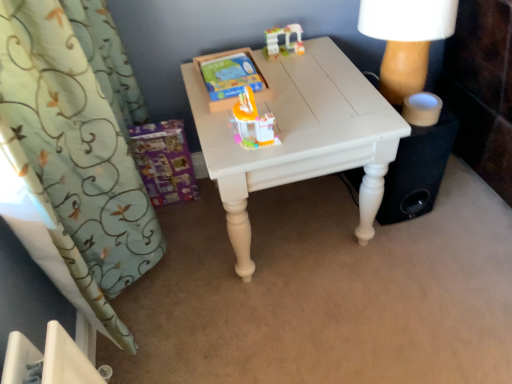
What do you see at coordinates (284, 41) in the screenshot?
I see `translucent plastic building at upper center, placed as the first toy when sorted from back to front` at bounding box center [284, 41].

What do you see at coordinates (300, 136) in the screenshot?
I see `white painted wood table at center` at bounding box center [300, 136].

The height and width of the screenshot is (384, 512). What do you see at coordinates (252, 123) in the screenshot?
I see `translucent plastic toy at center, acting as the second toy starting from the top` at bounding box center [252, 123].

The image size is (512, 384). I want to click on translucent plastic building at upper center, marked as the 2th toy in a front-to-back arrangement, so click(284, 41).

Is translucent plastic toy at center, the second toy when ordered from back to front, next to green floral fabric curtain at left?

translucent plastic toy at center, the second toy when ordered from back to front, and green floral fabric curtain at left are clearly separated.

From a real-world perspective, is translucent plastic toy at center, the second toy when ordered from back to front, physically located above or below green floral fabric curtain at left?

translucent plastic toy at center, the second toy when ordered from back to front, is above green floral fabric curtain at left.

Can you confirm if translucent plastic toy at center, arranged as the first toy when viewed from the front, is wider than green floral fabric curtain at left?

No.

You are a GUI agent. You are given a task and a screenshot of the screen. Output one action in this format:
    pyautogui.click(x=<x>, y=<y>)
    Task: Click on the curtain that is under the translucent plastic toy at center, arranged as the first toy when viewed from the front (from a real-world perspective)
    The height and width of the screenshot is (384, 512).
    Given the screenshot: What is the action you would take?
    pyautogui.click(x=81, y=141)

Is white painted wood table at center wider than translucent plastic toy at center, acting as the second toy starting from the top?

Yes, white painted wood table at center is wider than translucent plastic toy at center, acting as the second toy starting from the top.

Is white painted wood table at center inside or outside of translucent plastic toy at center, the second toy when ordered from back to front?

white painted wood table at center is not inside translucent plastic toy at center, the second toy when ordered from back to front, it's outside.

Considering the sizes of objects white painted wood table at center and translucent plastic toy at center, acting as the second toy starting from the top, in the image provided, who is taller, white painted wood table at center or translucent plastic toy at center, acting as the second toy starting from the top,?

white painted wood table at center is taller.

Does white painted wood table at center appear on the left side of green floral fabric curtain at left?

No.

In terms of size, does white painted wood table at center appear bigger or smaller than green floral fabric curtain at left?

white painted wood table at center is smaller than green floral fabric curtain at left.

From the image's perspective, is white painted wood table at center positioned above or below green floral fabric curtain at left?

Clearly, from the image's perspective, white painted wood table at center is below green floral fabric curtain at left.

Which is correct: white painted wood table at center is inside green floral fabric curtain at left, or outside of it?

white painted wood table at center is not inside green floral fabric curtain at left, it's outside.

Which of these two, translucent plastic building at upper center, which is the 1th toy in top-to-bottom order, or translucent plastic toy at center, acting as the second toy starting from the top, is bigger?

Bigger between the two is translucent plastic toy at center, acting as the second toy starting from the top.

From the image's perspective, is translucent plastic building at upper center, which is the 1th toy in top-to-bottom order, beneath translucent plastic toy at center, acting as the second toy starting from the top?

Incorrect, from the image's perspective, translucent plastic building at upper center, which is the 1th toy in top-to-bottom order, is higher than translucent plastic toy at center, acting as the second toy starting from the top.

From a real-world perspective, which is physically above, translucent plastic building at upper center, which is counted as the 2th toy, starting from the bottom, or translucent plastic toy at center, acting as the second toy starting from the top?

translucent plastic toy at center, acting as the second toy starting from the top, from a real-world perspective.

Looking at this image, considering their positions, is translucent plastic building at upper center, which is counted as the 2th toy, starting from the bottom, located in front of or behind translucent plastic toy at center, acting as the second toy starting from the top?

translucent plastic building at upper center, which is counted as the 2th toy, starting from the bottom, is behind translucent plastic toy at center, acting as the second toy starting from the top.

Can you confirm if green floral fabric curtain at left is positioned to the right of white painted wood table at center?

Incorrect, green floral fabric curtain at left is not on the right side of white painted wood table at center.

Is the depth of green floral fabric curtain at left less than that of white painted wood table at center?

Yes, it is in front of white painted wood table at center.

Looking at this image, is green floral fabric curtain at left facing towards white painted wood table at center?

Yes.

Considering the sizes of objects green floral fabric curtain at left and white painted wood table at center in the image provided, who is smaller, green floral fabric curtain at left or white painted wood table at center?

white painted wood table at center is smaller.

Which is in front, white painted wood table at center or translucent plastic building at upper center, placed as the first toy when sorted from back to front?

white painted wood table at center is in front.

From a real-world perspective, is white painted wood table at center positioned over translucent plastic building at upper center, which is the 1th toy in top-to-bottom order, based on gravity?

Incorrect, from a real-world perspective, white painted wood table at center is lower than translucent plastic building at upper center, which is the 1th toy in top-to-bottom order.

Is the surface of white painted wood table at center in direct contact with translucent plastic building at upper center, which is counted as the 2th toy, starting from the bottom?

No, white painted wood table at center is not beside translucent plastic building at upper center, which is counted as the 2th toy, starting from the bottom.

From a real-world perspective, which object stands above the other?

translucent plastic building at upper center, which is counted as the 2th toy, starting from the bottom, is physically above.

Can you confirm if green floral fabric curtain at left is taller than translucent plastic building at upper center, which is counted as the 2th toy, starting from the bottom?

Yes.

How far apart are green floral fabric curtain at left and translucent plastic building at upper center, which is the 1th toy in top-to-bottom order?

green floral fabric curtain at left and translucent plastic building at upper center, which is the 1th toy in top-to-bottom order, are 65.17 centimeters apart from each other.

From the picture: From the image's perspective, does green floral fabric curtain at left appear higher than translucent plastic building at upper center, placed as the first toy when sorted from back to front?

No, from the image's perspective, green floral fabric curtain at left is not above translucent plastic building at upper center, placed as the first toy when sorted from back to front.

The image size is (512, 384). I want to click on curtain in front of the translucent plastic toy at center, the second toy when ordered from back to front, so click(x=81, y=141).

What are the coordinates of `table on the right of translucent plastic toy at center, the second toy when ordered from back to front` in the screenshot? It's located at (300, 136).

Based on their spatial positions, is translucent plastic toy at center, which is the 1th toy from bottom to top, or translucent plastic building at upper center, which is the 1th toy in top-to-bottom order, further from green floral fabric curtain at left?

translucent plastic building at upper center, which is the 1th toy in top-to-bottom order, is further to green floral fabric curtain at left.

Based on the photo, looking at the image, which one is located further to translucent plastic toy at center, acting as the second toy starting from the top, white painted wood table at center or translucent plastic building at upper center, marked as the 2th toy in a front-to-back arrangement?

Based on the image, translucent plastic building at upper center, marked as the 2th toy in a front-to-back arrangement, appears to be further to translucent plastic toy at center, acting as the second toy starting from the top.

When comparing their distances from white painted wood table at center, does translucent plastic building at upper center, placed as the first toy when sorted from back to front, or translucent plastic toy at center, arranged as the first toy when viewed from the front, seem closer?

Among the two, translucent plastic toy at center, arranged as the first toy when viewed from the front, is located nearer to white painted wood table at center.

Considering their positions, is translucent plastic building at upper center, marked as the 2th toy in a front-to-back arrangement, positioned further to translucent plastic toy at center, the second toy when ordered from back to front, than white painted wood table at center?

translucent plastic building at upper center, marked as the 2th toy in a front-to-back arrangement, is positioned further to the anchor translucent plastic toy at center, the second toy when ordered from back to front.

Based on their spatial positions, is green floral fabric curtain at left or translucent plastic toy at center, acting as the second toy starting from the top, closer to translucent plastic building at upper center, which is the 1th toy in top-to-bottom order?

Based on the image, translucent plastic toy at center, acting as the second toy starting from the top, appears to be nearer to translucent plastic building at upper center, which is the 1th toy in top-to-bottom order.

Looking at the image, which one is located further to green floral fabric curtain at left, translucent plastic toy at center, arranged as the first toy when viewed from the front, or white painted wood table at center?

translucent plastic toy at center, arranged as the first toy when viewed from the front, is positioned further to the anchor green floral fabric curtain at left.

Considering their positions, is white painted wood table at center positioned further to translucent plastic toy at center, acting as the second toy starting from the top, than green floral fabric curtain at left?

The object further to translucent plastic toy at center, acting as the second toy starting from the top, is green floral fabric curtain at left.

Considering their positions, is green floral fabric curtain at left positioned closer to white painted wood table at center than translucent plastic building at upper center, marked as the 2th toy in a front-to-back arrangement?

Based on the image, translucent plastic building at upper center, marked as the 2th toy in a front-to-back arrangement, appears to be nearer to white painted wood table at center.

I want to click on toy between translucent plastic building at upper center, which is counted as the 2th toy, starting from the bottom, and white painted wood table at center from top to bottom, so pos(252,123).

This screenshot has height=384, width=512. I want to click on toy positioned between green floral fabric curtain at left and translucent plastic building at upper center, which is the 1th toy in top-to-bottom order, from near to far, so click(x=252, y=123).

Locate an element on the screen. table positioned between green floral fabric curtain at left and translucent plastic building at upper center, marked as the 2th toy in a front-to-back arrangement, from near to far is located at coordinates (300, 136).